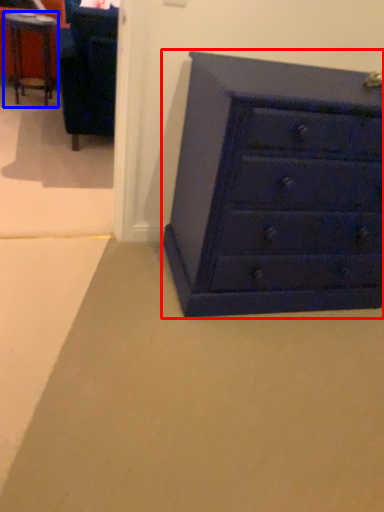
Question: Which of the following is the closest to the observer, chest of drawers (highlighted by a red box) or table (highlighted by a blue box)?

Choices:
 (A) chest of drawers
 (B) table

Answer: (A)